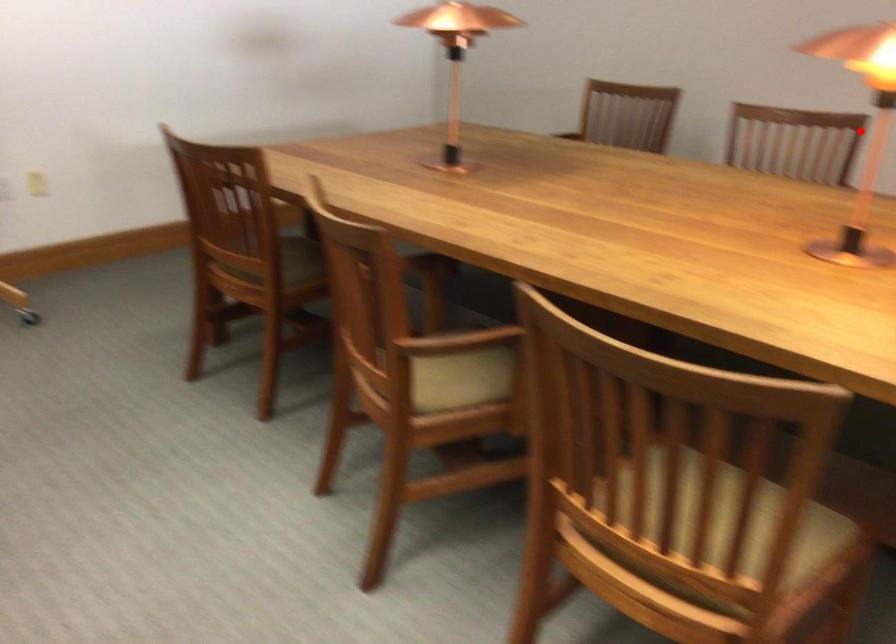
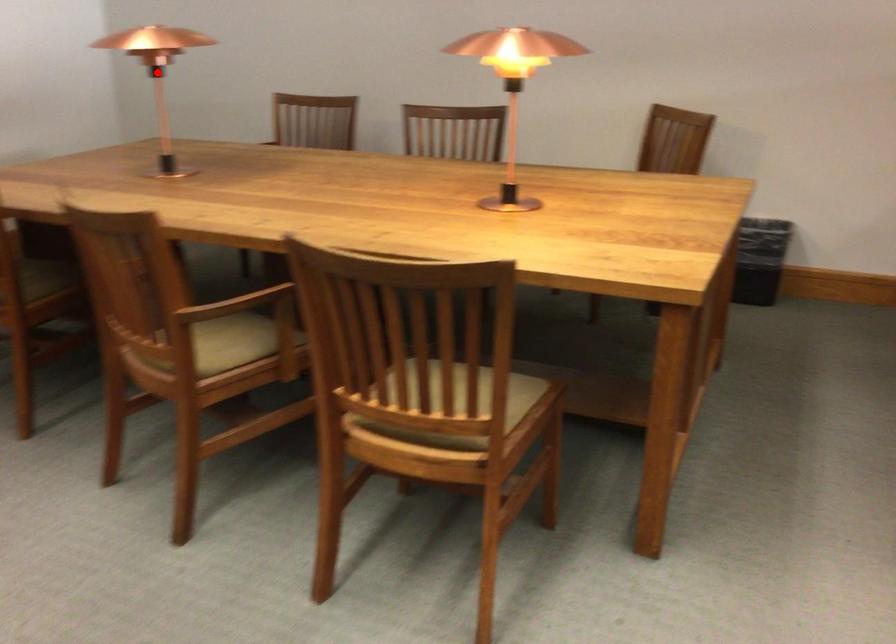
I am providing you with two images of the same scene from different viewpoints. A red point is marked on the first image and another point is marked on the second image. Do the highlighted points in image1 and image2 indicate the same real-world spot?

No